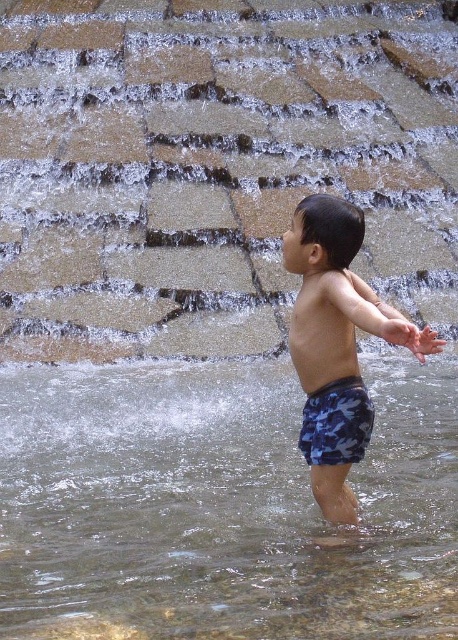
You are a photographer trying to capture the child in the scene. You notice two pairs of shorts labeled as blue camouflage shorts at center and camouflage fabric shorts at center. Which pair of shorts is higher up on the child?

The blue camouflage shorts at center is taller than camouflage fabric shorts at center, so the blue camouflage shorts at center are higher up on the child.